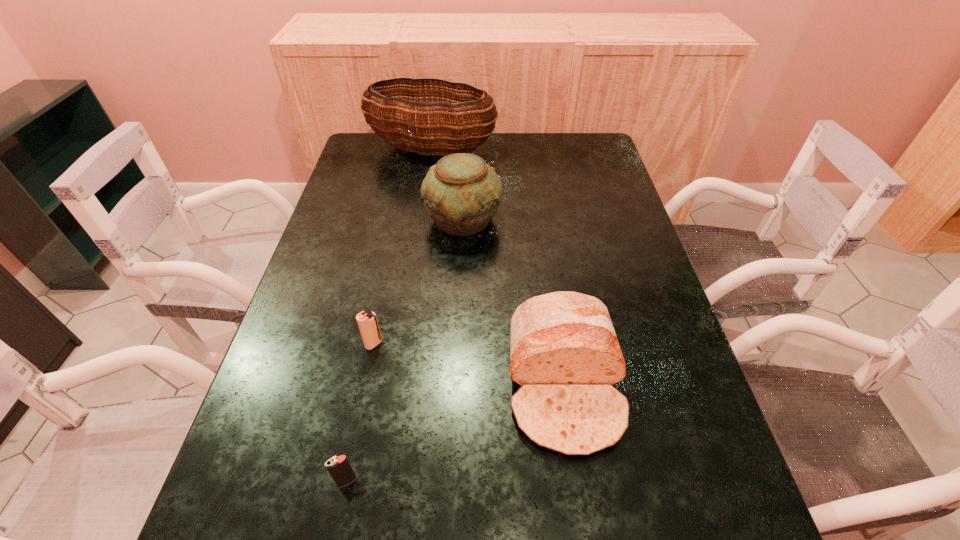
This screenshot has height=540, width=960. Find the location of `object identified as the closest to the nearer igniter`. object identified as the closest to the nearer igniter is located at coordinates (367, 322).